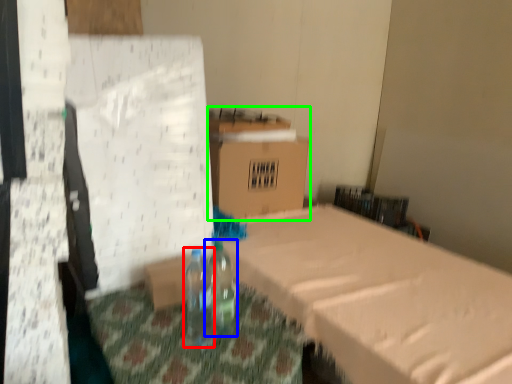
Question: Estimate the real-world distances between objects in this image. Which object is farther from bottle (highlighted by a red box), bottle (highlighted by a blue box) or cardboard box (highlighted by a green box)?

Choices:
 (A) bottle
 (B) cardboard box

Answer: (B)